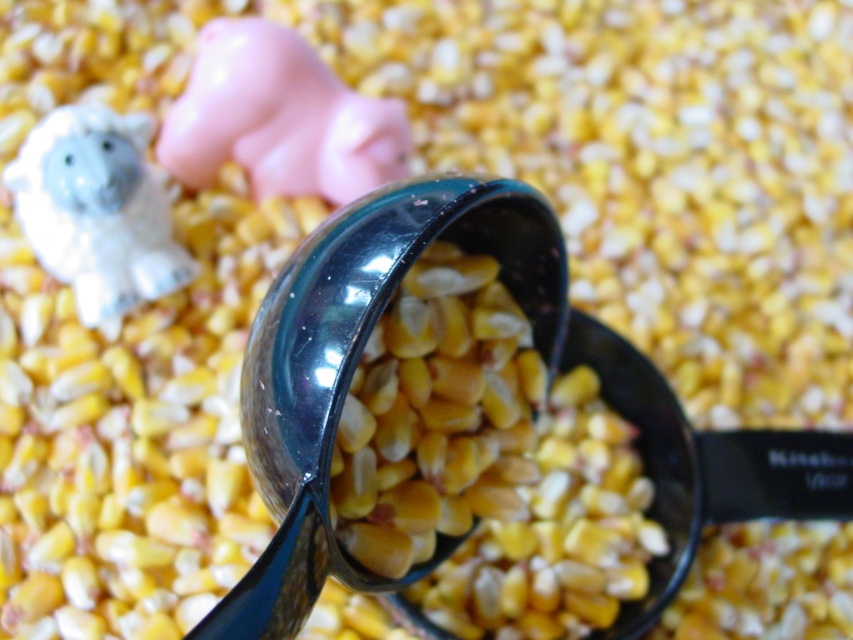
Question: Is pink rubber pig at upper center below white glossy figurine at upper left?

Choices:
 (A) no
 (B) yes

Answer: (A)

Question: Where is pink rubber pig at upper center located in relation to white glossy figurine at upper left in the image?

Choices:
 (A) below
 (B) above

Answer: (B)

Question: Does pink rubber pig at upper center appear on the right side of white glossy figurine at upper left?

Choices:
 (A) yes
 (B) no

Answer: (A)